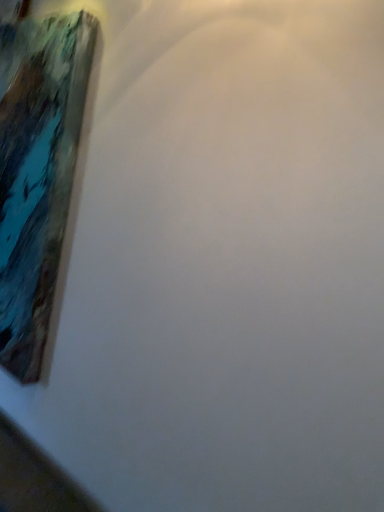
Question: Should I look upward or downward to see painted wood picture frame at upper left?

Choices:
 (A) down
 (B) up

Answer: (B)